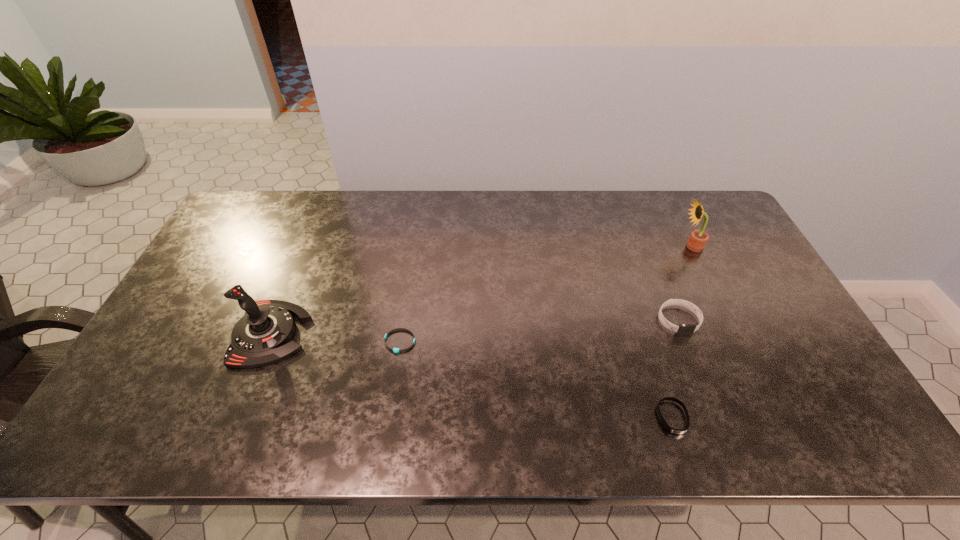
The height and width of the screenshot is (540, 960). I want to click on vacant region located on the face of the sunflower, so click(560, 246).

Image resolution: width=960 pixels, height=540 pixels. What are the coordinates of `vacant space situated on the face of the sunflower` in the screenshot? It's located at (652, 246).

In order to click on free space located on the handle side of the leftmost object in this screenshot , I will do `click(371, 334)`.

The width and height of the screenshot is (960, 540). I want to click on vacant region located on the outer surface of the third shortest object, so click(x=693, y=358).

I want to click on vacant area situated 0.220m on the buckle of the leftmost wristband, so click(x=385, y=436).

Where is `object at the near edge`? The image size is (960, 540). object at the near edge is located at coordinates (676, 431).

Identify the location of object present at the right edge. Image resolution: width=960 pixels, height=540 pixels. (698, 238).

Image resolution: width=960 pixels, height=540 pixels. I want to click on free space at the far edge, so [x=355, y=206].

The width and height of the screenshot is (960, 540). I want to click on vacant space at the near edge of the desktop, so click(492, 428).

What are the coordinates of `free spot at the right edge of the desktop` in the screenshot? It's located at (747, 324).